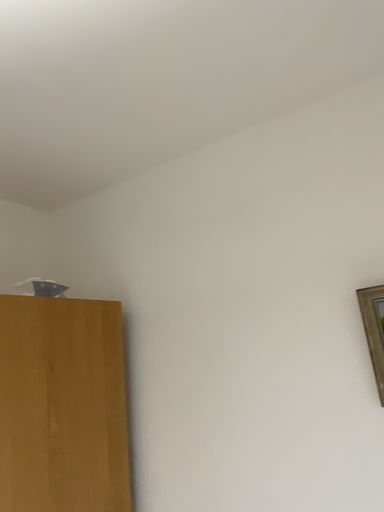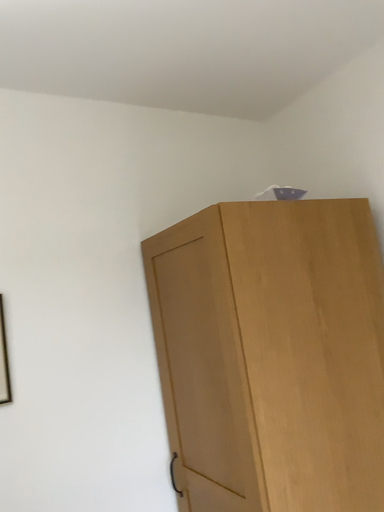
Question: How did the camera likely rotate when shooting the video?

Choices:
 (A) rotated left
 (B) rotated right

Answer: (A)